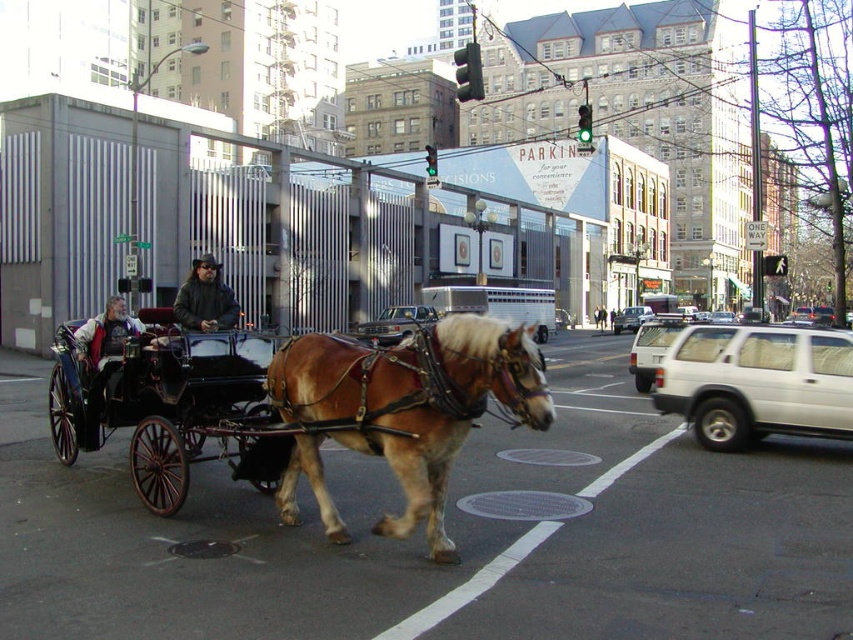
You are standing at the center of the street and want to move to the black polished wood wagon at left. Which direction should you move in to reach it?

You should move to the left to reach the black polished wood wagon at left since it is positioned at point 0.634 on the x axis, which is to the left of the center of the street.

You are standing on the street and want to reach the point marked at coordinates (662, 333). The horse and carriage are currently between you and that point. Can you walk around them to reach your destination?

The point marked at coordinates (662, 333) is 18.15 meters away from you. Since the horse and carriage are between you and the point, you can walk around them to reach the destination as long as there is enough space to maneuver around the carriage.